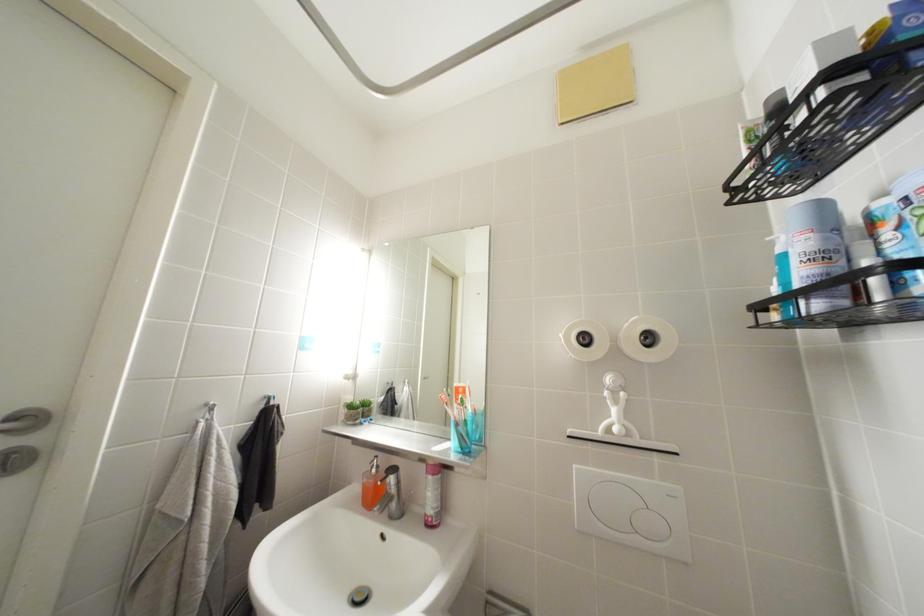
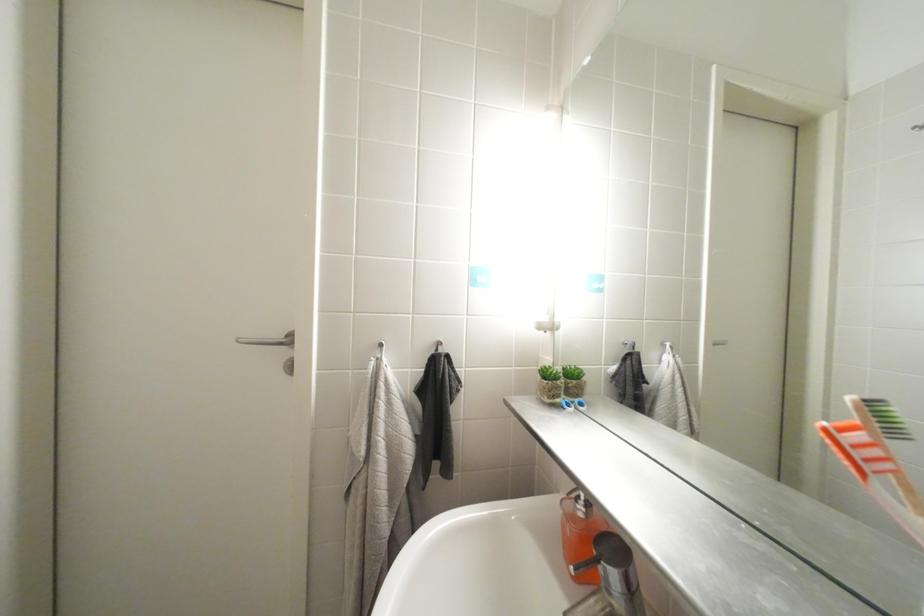
Question: The images are taken continuously from a first-person perspective. In which direction is your viewpoint rotating?

Choices:
 (A) Left
 (B) Right
 (C) Up
 (D) Down

Answer: (A)